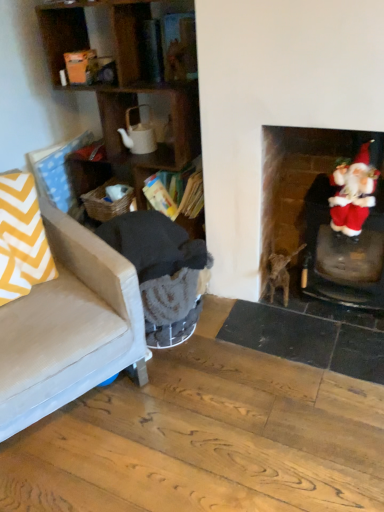
Question: From a real-world perspective, is dark gray fabric rocking chair at left on wooden bookshelf at center?

Choices:
 (A) no
 (B) yes

Answer: (A)

Question: Is dark gray fabric rocking chair at left to the right of wooden bookshelf at center from the viewer's perspective?

Choices:
 (A) yes
 (B) no

Answer: (B)

Question: Can wooden bookshelf at center be found inside dark gray fabric rocking chair at left?

Choices:
 (A) yes
 (B) no

Answer: (B)

Question: Is dark gray fabric rocking chair at left at the left side of wooden bookshelf at center?

Choices:
 (A) no
 (B) yes

Answer: (B)

Question: Considering the relative sizes of dark gray fabric rocking chair at left and wooden bookshelf at center in the image provided, is dark gray fabric rocking chair at left thinner than wooden bookshelf at center?

Choices:
 (A) yes
 (B) no

Answer: (B)

Question: Based on their sizes in the image, would you say brown fur cat at center is bigger or smaller than yellow chevron fabric at left?

Choices:
 (A) small
 (B) big

Answer: (B)

Question: Do you think brown fur cat at center is within yellow chevron fabric at left, or outside of it?

Choices:
 (A) outside
 (B) inside

Answer: (A)

Question: Is brown fur cat at center to the left or to the right of yellow chevron fabric at left in the image?

Choices:
 (A) right
 (B) left

Answer: (A)

Question: From the image's perspective, is brown fur cat at center above or below yellow chevron fabric at left?

Choices:
 (A) below
 (B) above

Answer: (A)

Question: Would you say dark gray fabric rocking chair at left is to the left or to the right of yellow chevron fabric at left in the picture?

Choices:
 (A) right
 (B) left

Answer: (A)

Question: Considering the positions of dark gray fabric rocking chair at left and yellow chevron fabric at left in the image, is dark gray fabric rocking chair at left bigger or smaller than yellow chevron fabric at left?

Choices:
 (A) big
 (B) small

Answer: (A)

Question: From the image's perspective, is dark gray fabric rocking chair at left located above or below yellow chevron fabric at left?

Choices:
 (A) above
 (B) below

Answer: (B)

Question: Does point (188, 315) appear closer or farther from the camera than point (41, 266)?

Choices:
 (A) farther
 (B) closer

Answer: (A)

Question: Looking at the image, does velvet santa at right seem bigger or smaller compared to brown fur cat at center?

Choices:
 (A) big
 (B) small

Answer: (B)

Question: Considering the positions of velvet santa at right and brown fur cat at center in the image, is velvet santa at right taller or shorter than brown fur cat at center?

Choices:
 (A) short
 (B) tall

Answer: (B)